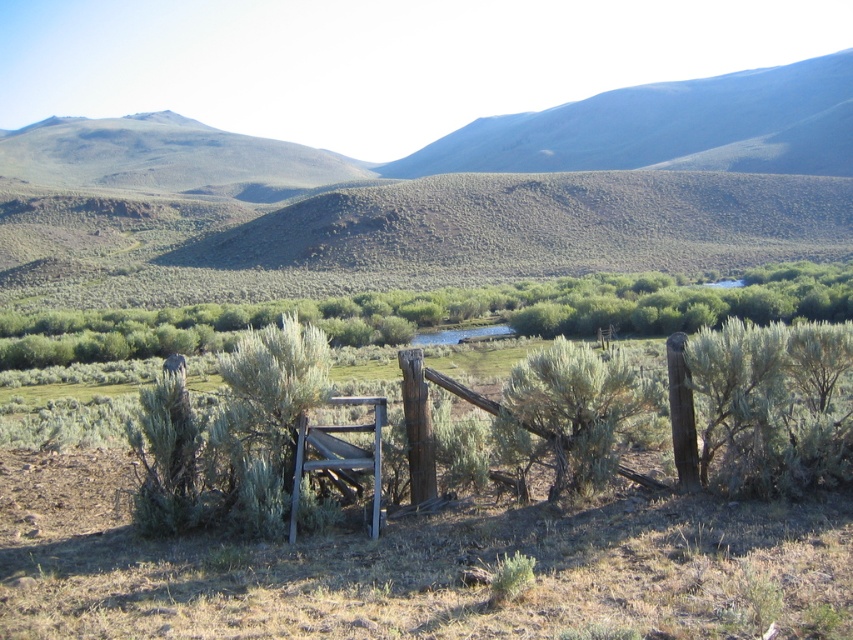
Question: Which object is positioned closest to the green bushy shrub at center?

Choices:
 (A) green grassy hill at center
 (B) wooden chair at center

Answer: (B)

Question: Which point is closer to the camera taking this photo?

Choices:
 (A) (758, 202)
 (B) (650, 404)
 (C) (378, 465)

Answer: (C)

Question: Considering the real-world distances, which object is closest to the green grassy hill at center?

Choices:
 (A) green bushy shrub at center
 (B) wooden chair at center

Answer: (B)

Question: Is the position of green grassy hill at center less distant than that of wooden chair at center?

Choices:
 (A) no
 (B) yes

Answer: (A)

Question: Is green grassy hill at center smaller than green bushy shrub at center?

Choices:
 (A) no
 (B) yes

Answer: (A)

Question: Is green grassy hill at center above green bushy shrub at center?

Choices:
 (A) no
 (B) yes

Answer: (B)